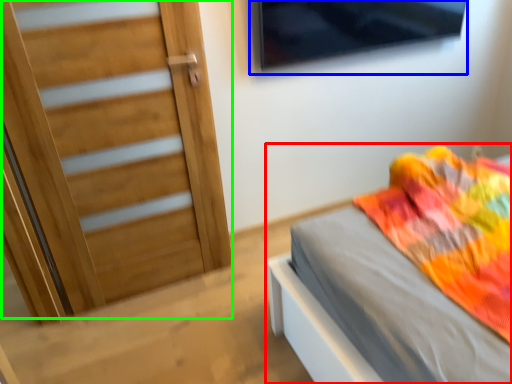
Question: Which object is positioned closest to bed (highlighted by a red box)? Select from window (highlighted by a blue box) and door (highlighted by a green box).

Choices:
 (A) window
 (B) door

Answer: (B)